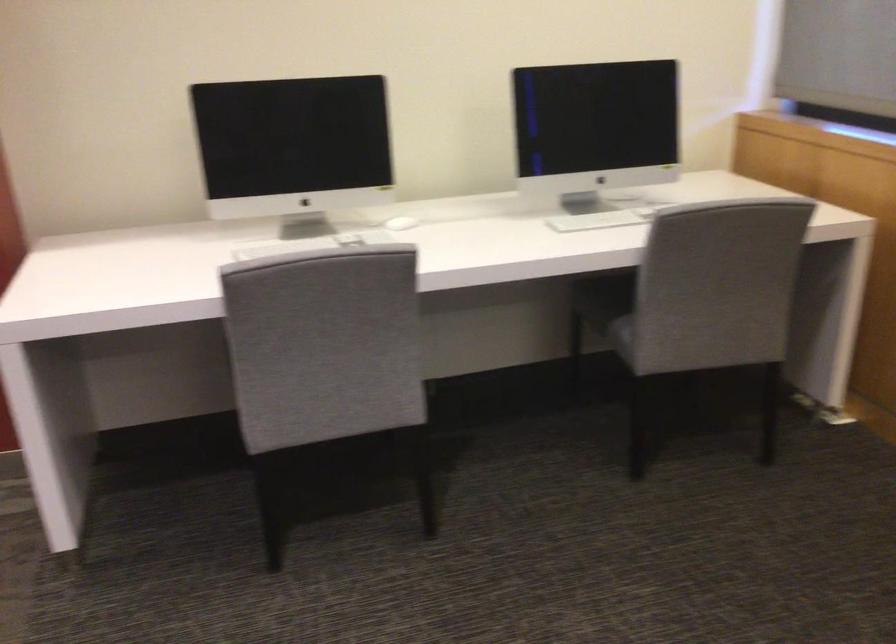
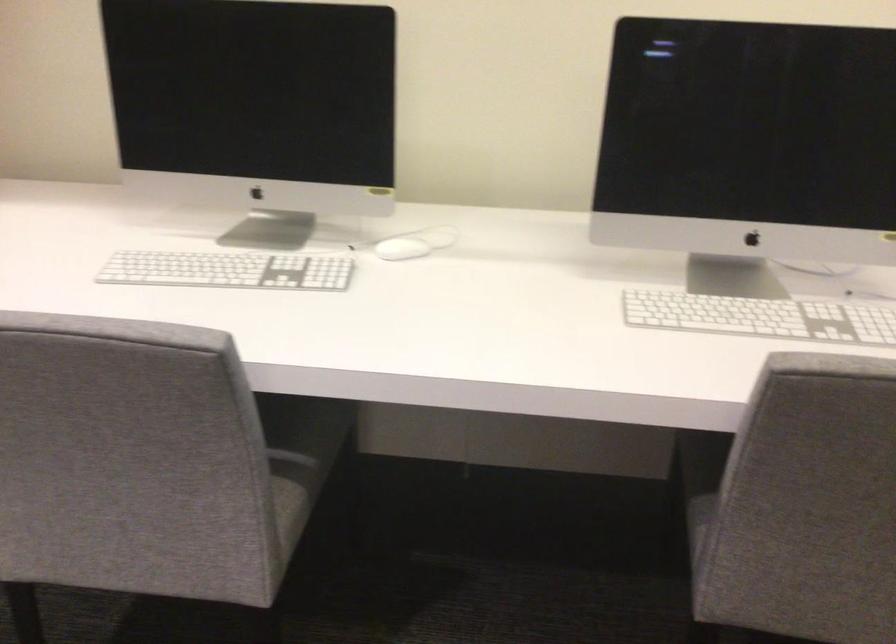
The point at (x=401, y=220) is marked in the first image. Where is the corresponding point in the second image?

(401, 249)